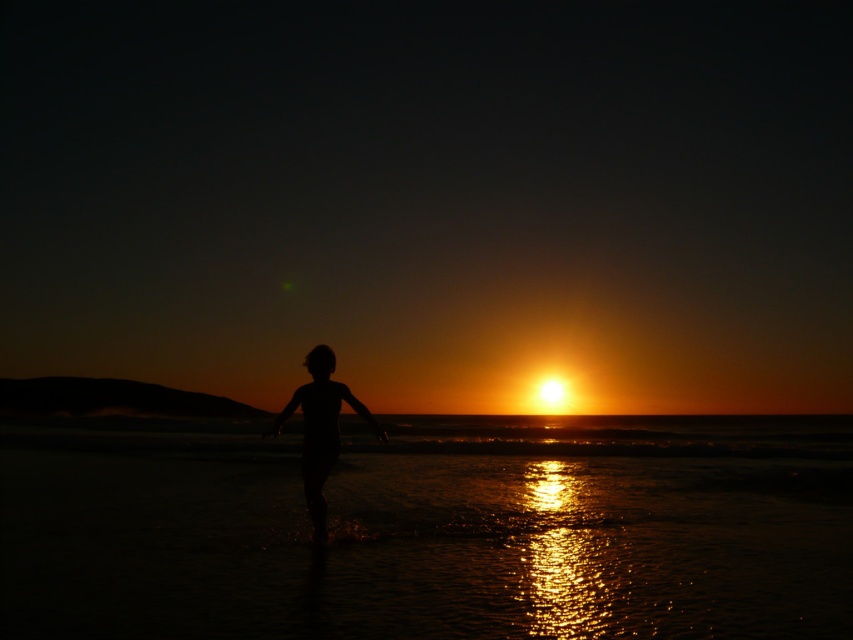
You are a drone operator trying to capture a photo of the silhouette skin at center and the shiny golden water at center from above. The drone has a camera with a 10 meter range. Can the drone capture both objects in a single photo without moving?

The distance between the shiny golden water at center and the silhouette skin at center is 19.01 meters. Since the drone camera has a 10 meter range, it cannot capture both objects in a single photo without moving, as the distance exceeds the camera range.

You are a photographer trying to capture the sunset scene. You notice the shiny golden water at center and the silhouette skin at center. Which object in the scene occupies a bigger area in the photo?

The shiny golden water at center occupies a bigger area in the photo because it has a larger size compared to the silhouette skin at center.